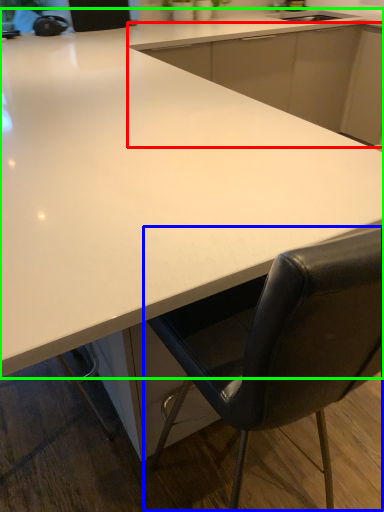
Question: Which is nearer to the cabinetry (highlighted by a red box)? chair (highlighted by a blue box) or countertop (highlighted by a green box).

Choices:
 (A) chair
 (B) countertop

Answer: (B)